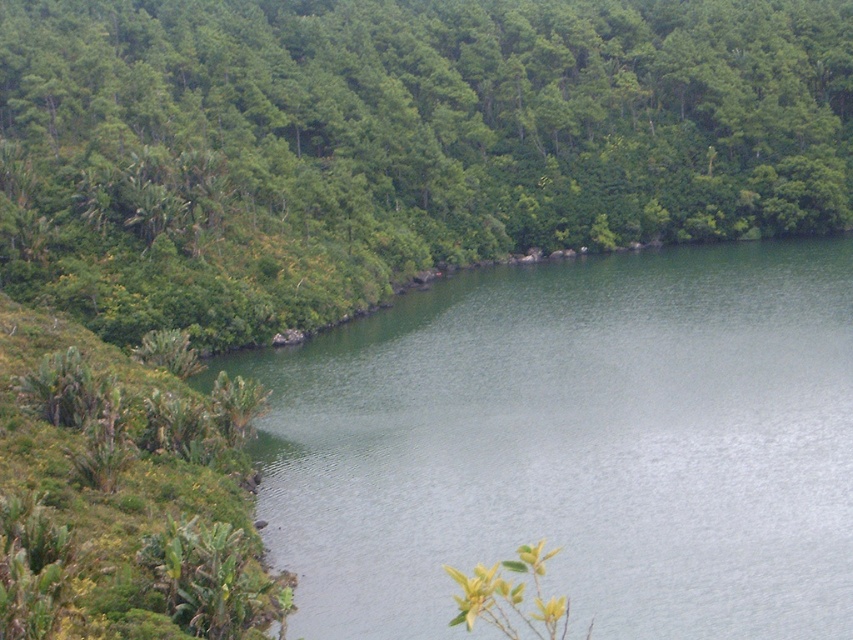
Can you confirm if green leafy tree at center is shorter than green smooth water at center?

No.

Measure the distance between green leafy tree at center and camera.

They are 151.05 meters apart.

Is point (407, 24) positioned behind point (570, 262)?

Yes, it is behind point (570, 262).

Find the location of a particular element. The height and width of the screenshot is (640, 853). green leafy tree at center is located at coordinates (393, 144).

Is green smooth water at center thinner than green leafy vegetation at lower left?

No, green smooth water at center is not thinner than green leafy vegetation at lower left.

Does green smooth water at center appear on the left side of green leafy vegetation at lower left?

No, green smooth water at center is not to the left of green leafy vegetation at lower left.

Describe the element at coordinates (575, 444) in the screenshot. I see `green smooth water at center` at that location.

Identify the location of green smooth water at center. The width and height of the screenshot is (853, 640). (575, 444).

Does green leafy tree at center appear on the left side of green leafy vegetation at lower left?

In fact, green leafy tree at center is to the right of green leafy vegetation at lower left.

Is green leafy tree at center to the right of green leafy vegetation at lower left from the viewer's perspective?

Correct, you'll find green leafy tree at center to the right of green leafy vegetation at lower left.

You are a GUI agent. You are given a task and a screenshot of the screen. Output one action in this format:
    pyautogui.click(x=<x>, y=<y>)
    Task: Click on the green leafy tree at center
    The width and height of the screenshot is (853, 640).
    Given the screenshot: What is the action you would take?
    pyautogui.click(x=393, y=144)